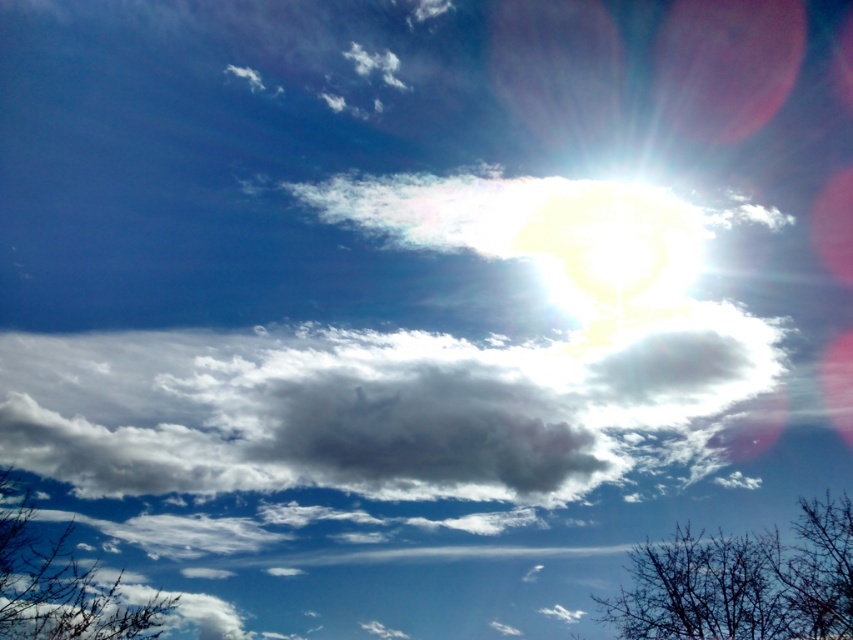
Who is taller, bare branches at lower right or brown textured branches at lower left?

brown textured branches at lower left is taller.

Which is more to the left, bare branches at lower right or brown textured branches at lower left?

From the viewer's perspective, brown textured branches at lower left appears more on the left side.

Who is more distant from viewer, (839, 508) or (16, 566)?

The point (839, 508) is behind.

The height and width of the screenshot is (640, 853). I want to click on bare branches at lower right, so click(x=741, y=582).

Is white fluffy cloud at center taller than brown textured branches at lower left?

Indeed, white fluffy cloud at center has a greater height compared to brown textured branches at lower left.

This screenshot has height=640, width=853. What do you see at coordinates (364, 406) in the screenshot? I see `white fluffy cloud at center` at bounding box center [364, 406].

Is point (221, 433) behind point (22, 492)?

Yes.

In order to click on white fluffy cloud at center in this screenshot , I will do `click(364, 406)`.

Looking at this image, is white fluffy cloud at center to the right of bare branches at lower right from the viewer's perspective?

No, white fluffy cloud at center is not to the right of bare branches at lower right.

Measure the distance between point (602, 456) and camera.

27.36 meters

The height and width of the screenshot is (640, 853). Describe the element at coordinates (364, 406) in the screenshot. I see `white fluffy cloud at center` at that location.

Locate an element on the screen. The image size is (853, 640). white fluffy cloud at center is located at coordinates (364, 406).